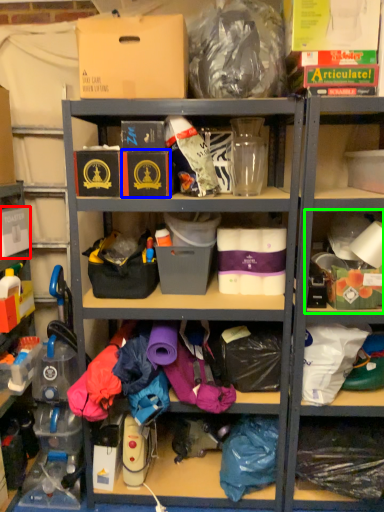
Question: Which object is the farthest from storage box (highlighted by a red box)? Choose among these: storage box (highlighted by a blue box) or shelf (highlighted by a green box).

Choices:
 (A) storage box
 (B) shelf

Answer: (B)